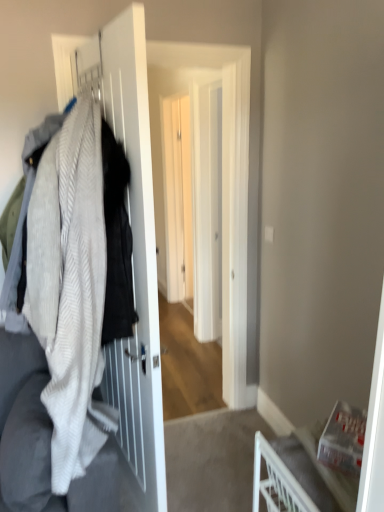
Question: Are white textured blanket at left and white glossy screen door at center, acting as the first screen door starting from the back, making contact?

Choices:
 (A) yes
 (B) no

Answer: (B)

Question: Is white textured blanket at left facing towards white glossy screen door at center, acting as the first screen door starting from the back?

Choices:
 (A) yes
 (B) no

Answer: (B)

Question: Does white textured blanket at left have a greater height compared to white glossy screen door at center, which is the 2th screen door in front-to-back order?

Choices:
 (A) no
 (B) yes

Answer: (A)

Question: Is white textured blanket at left to the left of white glossy screen door at center, which is the 2th screen door in front-to-back order, from the viewer's perspective?

Choices:
 (A) yes
 (B) no

Answer: (A)

Question: Is white textured blanket at left surrounding white glossy screen door at center, which is the 2th screen door in front-to-back order?

Choices:
 (A) yes
 (B) no

Answer: (B)

Question: Does point (124, 343) appear closer or farther from the camera than point (104, 239)?

Choices:
 (A) closer
 (B) farther

Answer: (B)

Question: From the image's perspective, relative to white textured blanket at left, is white matte screen door at left, the first screen door from the front, above or below?

Choices:
 (A) below
 (B) above

Answer: (A)

Question: Is white matte screen door at left, the first screen door from the front, taller or shorter than white textured blanket at left?

Choices:
 (A) tall
 (B) short

Answer: (A)

Question: Looking at their shapes, would you say white matte screen door at left, which appears as the 2th screen door when viewed from the back, is wider or thinner than white textured blanket at left?

Choices:
 (A) thin
 (B) wide

Answer: (A)

Question: In terms of size, does white matte screen door at left, which appears as the 2th screen door when viewed from the back, appear bigger or smaller than white plastic chair at lower right?

Choices:
 (A) small
 (B) big

Answer: (B)

Question: Visually, is white matte screen door at left, which appears as the 2th screen door when viewed from the back, positioned to the left or to the right of white plastic chair at lower right?

Choices:
 (A) left
 (B) right

Answer: (A)

Question: From the image's perspective, is white matte screen door at left, which appears as the 2th screen door when viewed from the back, positioned above or below white plastic chair at lower right?

Choices:
 (A) below
 (B) above

Answer: (B)

Question: Is point (155, 266) closer or farther from the camera than point (281, 507)?

Choices:
 (A) closer
 (B) farther

Answer: (B)

Question: Is white textured blanket at left inside the boundaries of white matte screen door at left, which appears as the 2th screen door when viewed from the back, or outside?

Choices:
 (A) inside
 (B) outside

Answer: (B)

Question: Considering the positions of white textured blanket at left and white matte screen door at left, the first screen door from the front, in the image, is white textured blanket at left wider or thinner than white matte screen door at left, the first screen door from the front,?

Choices:
 (A) wide
 (B) thin

Answer: (A)